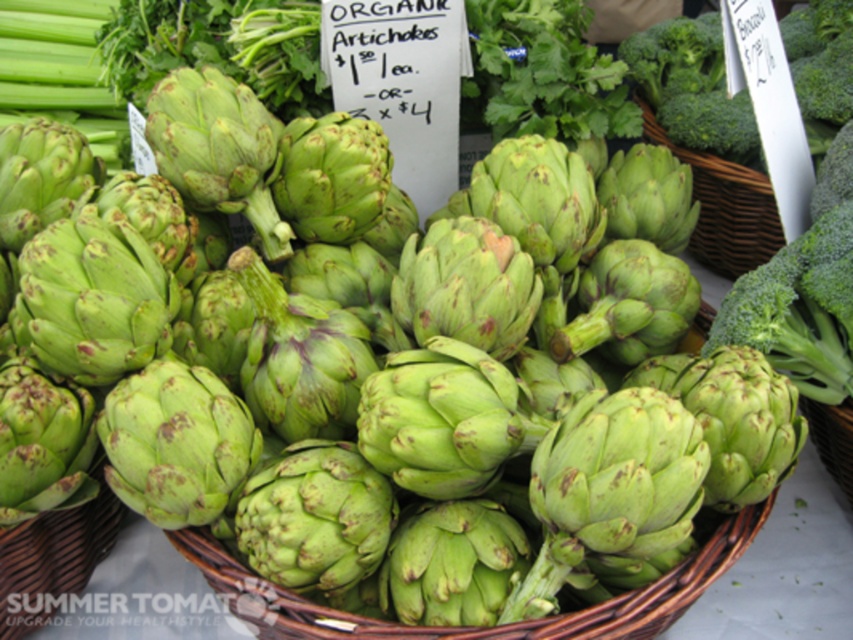
Consider the image. You are at a farmer market and want to buy some artichokes. The vendor points to a spot marked by a point at coordinates [486,627]. Where is this point located in the scene?

The point at coordinates [486,627] marks the green wicker basket at center where the artichokes are piled.

You are setting up a display for a farmer market. You have two baskets, the green wicker basket at center and the woven brown basket at right. Which basket is shorter?

The green wicker basket at center is shorter than the woven brown basket at right.